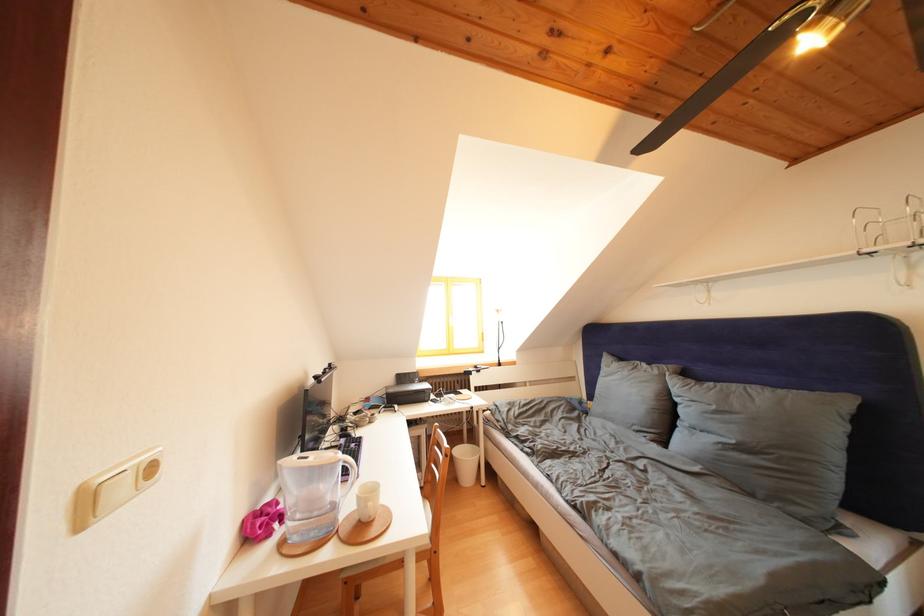
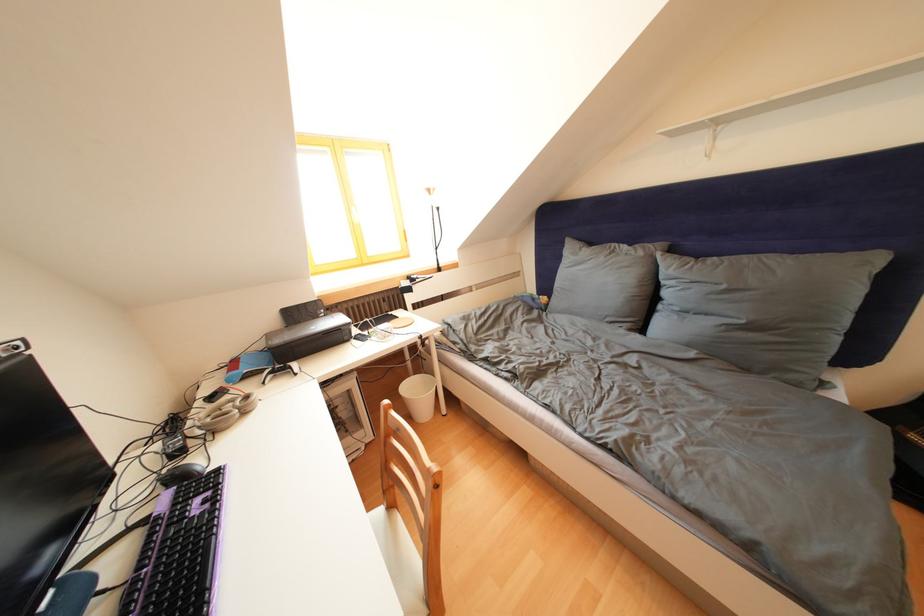
Where in the second image is the point corresponding to the point at 722,411 from the first image?

(733, 292)